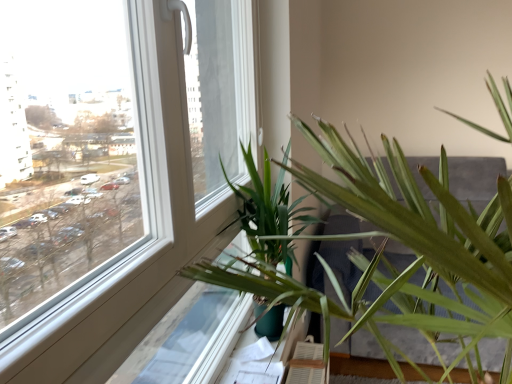
Question: Is green plastic at lower center further to camera compared to green matte plant at lower center?

Choices:
 (A) no
 (B) yes

Answer: (B)

Question: Is green plastic at lower center facing towards green matte plant at lower center?

Choices:
 (A) yes
 (B) no

Answer: (A)

Question: Considering the relative sizes of green plastic at lower center and green matte plant at lower center in the image provided, is green plastic at lower center wider than green matte plant at lower center?

Choices:
 (A) yes
 (B) no

Answer: (B)

Question: Does green plastic at lower center appear on the right side of green matte plant at lower center?

Choices:
 (A) yes
 (B) no

Answer: (B)

Question: Are green plastic at lower center and green matte plant at lower center located far from each other?

Choices:
 (A) no
 (B) yes

Answer: (A)

Question: From the image's perspective, is green plastic at lower center beneath green matte plant at lower center?

Choices:
 (A) yes
 (B) no

Answer: (A)

Question: Is green plastic at lower center next to green leafy palm at center?

Choices:
 (A) no
 (B) yes

Answer: (A)

Question: Is green plastic at lower center further to camera compared to green leafy palm at center?

Choices:
 (A) no
 (B) yes

Answer: (B)

Question: Considering the relative positions of green plastic at lower center and green leafy palm at center in the image provided, is green plastic at lower center to the left of green leafy palm at center from the viewer's perspective?

Choices:
 (A) yes
 (B) no

Answer: (A)

Question: Is green leafy palm at center located within green plastic at lower center?

Choices:
 (A) no
 (B) yes

Answer: (A)

Question: From a real-world perspective, is green plastic at lower center over green leafy palm at center?

Choices:
 (A) no
 (B) yes

Answer: (A)

Question: Is green plastic at lower center turned away from green leafy palm at center?

Choices:
 (A) yes
 (B) no

Answer: (B)

Question: Does green matte plant at lower center turn towards green plastic at lower center?

Choices:
 (A) yes
 (B) no

Answer: (B)